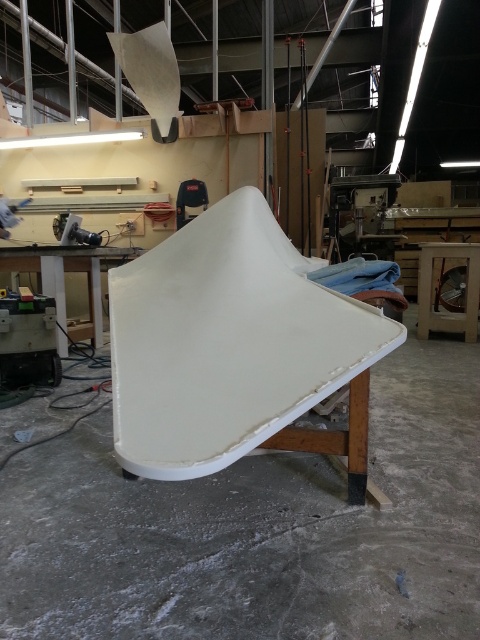
Question: Which of the following is the farthest from the observer?

Choices:
 (A) 143,374
 (B) 55,266

Answer: (B)

Question: Which point is farther to the camera?

Choices:
 (A) (132, 256)
 (B) (251, 355)

Answer: (A)

Question: Does white matte surfboard at center have a larger size compared to white matte workbench at left?

Choices:
 (A) yes
 (B) no

Answer: (B)

Question: Considering the relative positions of white matte surfboard at center and white matte workbench at left in the image provided, where is white matte surfboard at center located with respect to white matte workbench at left?

Choices:
 (A) right
 (B) left

Answer: (A)

Question: In this image, where is white matte surfboard at center located relative to white matte workbench at left?

Choices:
 (A) above
 (B) below

Answer: (B)